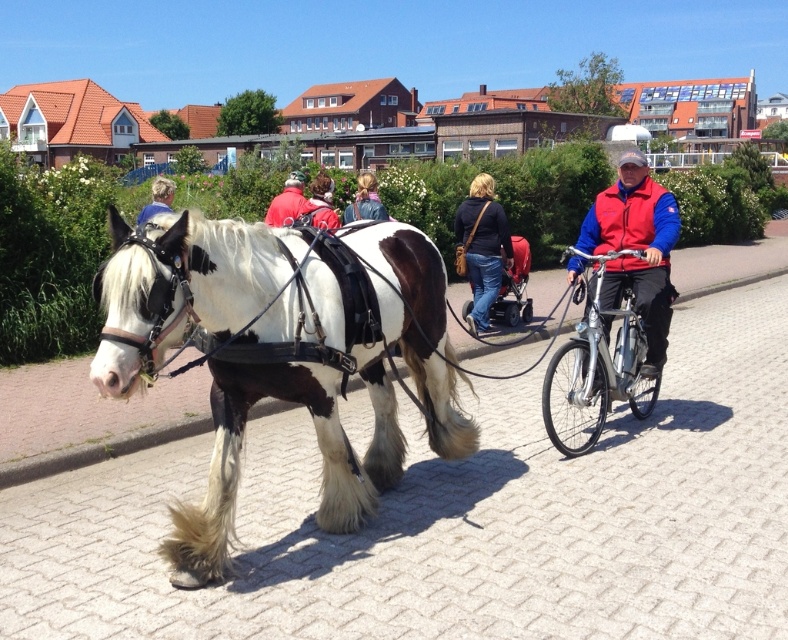
You are standing at the camera position and want to throw a frisbee to a friend who is 10 meters away from you. Is the red jacket at center between you and your friend?

The red jacket at center is 8.71 meters from camera, so yes, the red jacket at center is between you and your friend who is 10 meters away.

You are a pedestrian trying to cross the street safely. You see the red jacket at center and the blonde hair at upper left. Which object is larger in size?

The red jacket at center is bigger than the blonde hair at upper left.